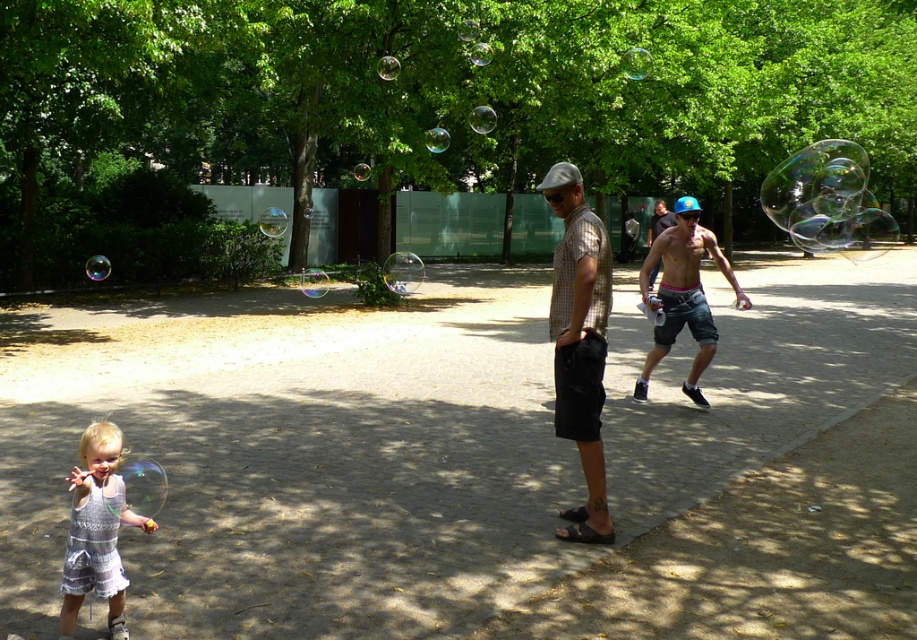
Consider the image. Is white lace dress at lower left above shiny blue cap at center?

Actually, white lace dress at lower left is below shiny blue cap at center.

Is point (111, 547) closer to camera compared to point (692, 307)?

Yes, point (111, 547) is in front of point (692, 307).

The image size is (917, 640). I want to click on white lace dress at lower left, so click(x=97, y=529).

Can you confirm if checkered fabric shirt at center is bigger than white lace dress at lower left?

Indeed, checkered fabric shirt at center has a larger size compared to white lace dress at lower left.

Is the position of checkered fabric shirt at center less distant than that of white lace dress at lower left?

That is False.

Which is in front, point (562, 392) or point (87, 426)?

Point (562, 392) is more forward.

Locate an element on the screen. The width and height of the screenshot is (917, 640). checkered fabric shirt at center is located at coordinates (579, 342).

Between point (562, 358) and point (670, 342), which one is positioned in front?

Point (562, 358)

Which is more to the left, checkered fabric shirt at center or shiny blue cap at center?

checkered fabric shirt at center

The width and height of the screenshot is (917, 640). Describe the element at coordinates (579, 342) in the screenshot. I see `checkered fabric shirt at center` at that location.

You are a GUI agent. You are given a task and a screenshot of the screen. Output one action in this format:
    pyautogui.click(x=<x>, y=<y>)
    Task: Click on the checkered fabric shirt at center
    This screenshot has height=640, width=917.
    Given the screenshot: What is the action you would take?
    pyautogui.click(x=579, y=342)